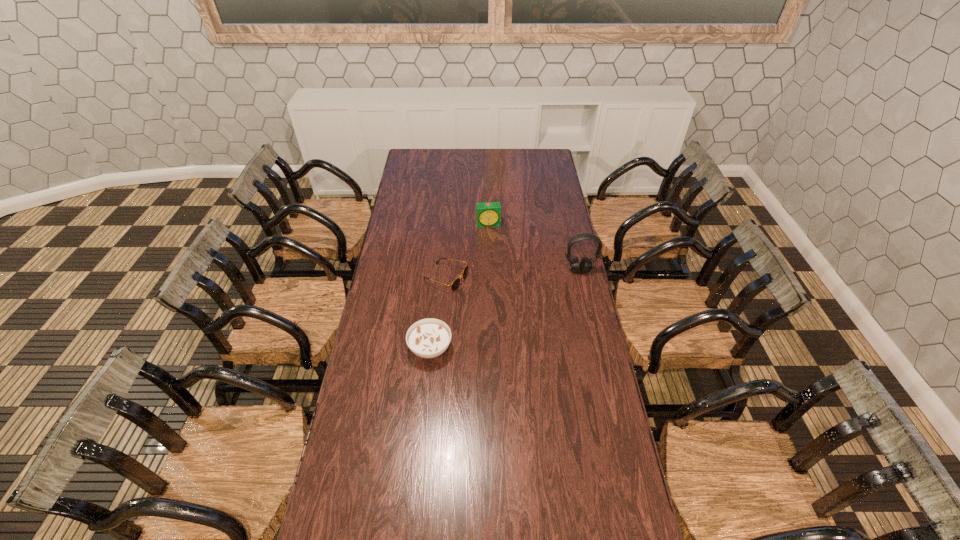
Locate an element on the screen. This screenshot has width=960, height=540. free space located 0.130m on the lenses of the shortest object is located at coordinates (492, 295).

The image size is (960, 540). I want to click on vacant space located on the lenses of the shortest object, so click(475, 289).

Identify the location of free point located on the front-facing side of the third object from left to right. The width and height of the screenshot is (960, 540). (494, 254).

Find the location of a particular element. This screenshot has width=960, height=540. free space located 0.350m on the front-facing side of the third object from left to right is located at coordinates (497, 277).

You are a GUI agent. You are given a task and a screenshot of the screen. Output one action in this format:
    pyautogui.click(x=<x>, y=<y>)
    Task: Click on the vacant area situated 0.070m on the front-facing side of the third object from left to right
    This screenshot has width=960, height=540.
    Given the screenshot: What is the action you would take?
    pyautogui.click(x=492, y=237)

Where is `object that is at the right edge`? This screenshot has width=960, height=540. object that is at the right edge is located at coordinates (585, 266).

Image resolution: width=960 pixels, height=540 pixels. Identify the location of free space at the left edge of the desktop. pos(393,317).

You are a GUI agent. You are given a task and a screenshot of the screen. Output one action in this format:
    pyautogui.click(x=<x>, y=<y>)
    Task: Click on the free space at the right edge of the desktop
    
    Given the screenshot: What is the action you would take?
    pyautogui.click(x=541, y=211)

This screenshot has height=540, width=960. In order to click on vacant space at the far left corner of the desktop in this screenshot , I will do `click(406, 155)`.

Image resolution: width=960 pixels, height=540 pixels. I want to click on free location at the near left corner of the desktop, so click(333, 503).